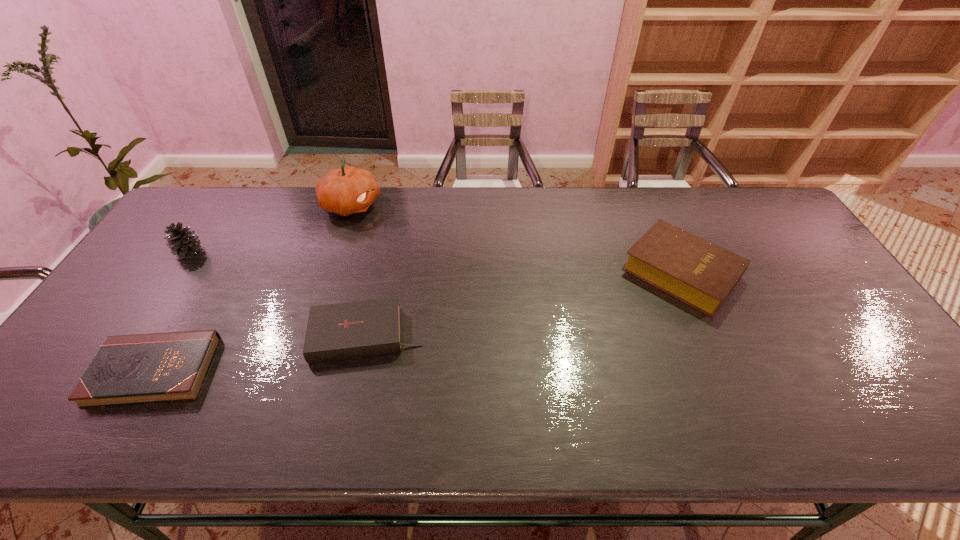
At what (x,y) coordinates should I click in order to perform the action: click on free space between the farthest object and the rightmost Bible. Please return your answer as a coordinate pair (x, y). Looking at the image, I should click on (516, 239).

Find the location of `vacant space that's between the rightmost Bible and the shortest object`. vacant space that's between the rightmost Bible and the shortest object is located at coordinates (418, 322).

I want to click on vacant area that lies between the rightmost object and the shortest Bible, so click(418, 322).

Select which object is the third closest to the pumpkin. Please provide its 2D coordinates. Your answer should be formatted as a tuple, i.e. [(x, y)], where the tuple contains the x and y coordinates of a point satisfying the conditions above.

[(158, 367)]

You are a GUI agent. You are given a task and a screenshot of the screen. Output one action in this format:
    pyautogui.click(x=<x>, y=<y>)
    Task: Click on the object that can be found as the third closest to the second Bible from left to right
    Image resolution: width=960 pixels, height=540 pixels.
    Given the screenshot: What is the action you would take?
    pyautogui.click(x=182, y=241)

The width and height of the screenshot is (960, 540). In order to click on the closest Bible to the tallest object in this screenshot , I will do `click(348, 330)`.

Locate an element on the screen. the closest Bible to the second Bible from right to left is located at coordinates (158, 367).

The height and width of the screenshot is (540, 960). Identify the location of free spot that satisfies the following two spatial constraints: 1. on the front face of the rightmost object; 2. on the right side of the farthest object. (329, 272).

Locate an element on the screen. This screenshot has width=960, height=540. vacant position in the image that satisfies the following two spatial constraints: 1. on the back side of the shortest Bible; 2. on the left side of the second Bible from right to left is located at coordinates (176, 335).

The height and width of the screenshot is (540, 960). I want to click on blank space that satisfies the following two spatial constraints: 1. on the front face of the pumpkin; 2. on the right side of the rightmost Bible, so click(329, 272).